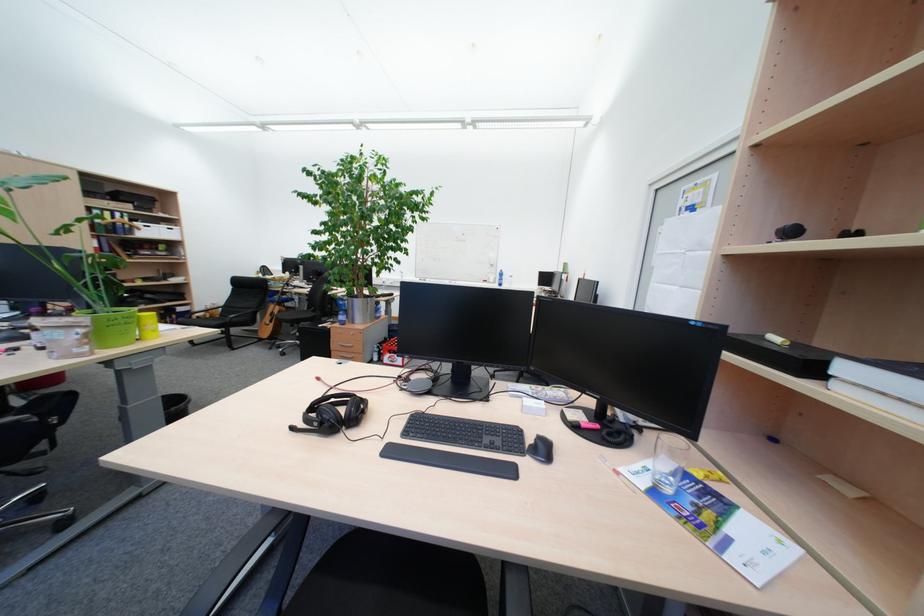
Where would you lift the black keyboard? Please return your answer as a coordinate pair (x, y).

(465, 432)